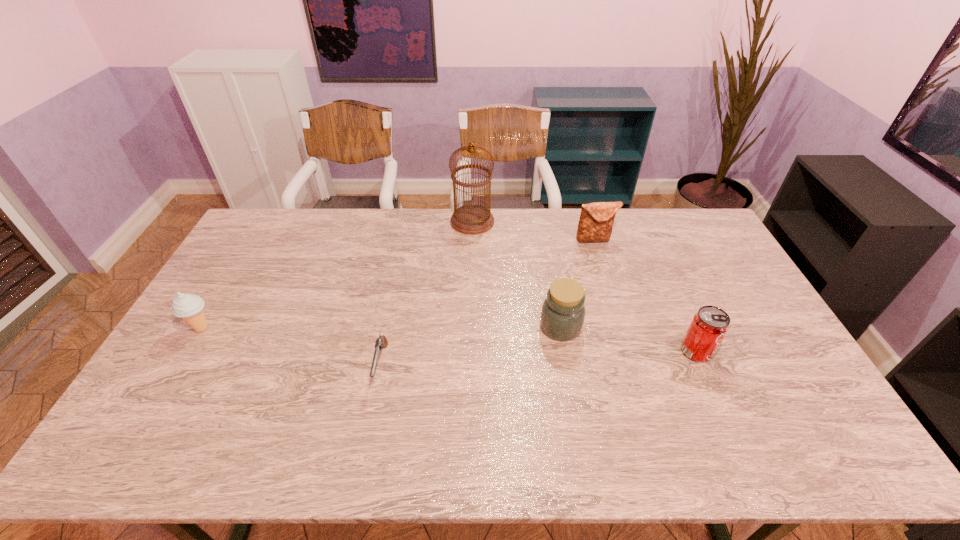
This screenshot has height=540, width=960. Identify the location of free spot located 0.320m on the front of the jar. (582, 450).

Identify the location of free space located on the right of the pop soda. (732, 351).

Find the location of a particular element. vacant area situated on the back of the leftmost object is located at coordinates (219, 299).

At what (x,y) coordinates should I click in order to perform the action: click on free space located aiming along the barrel of the second object from left to right. Please return your answer as a coordinate pair (x, y). Looking at the image, I should click on (366, 441).

Identify the location of birdcage at the far edge. This screenshot has width=960, height=540. (472, 219).

The height and width of the screenshot is (540, 960). I want to click on clutch bag at the far edge, so click(596, 220).

At what (x,y) coordinates should I click in order to perform the action: click on object that is positioned at the left edge. Please return your answer as a coordinate pair (x, y). Image resolution: width=960 pixels, height=540 pixels. Looking at the image, I should click on (189, 307).

Where is `free space at the far edge of the desktop`? The height and width of the screenshot is (540, 960). free space at the far edge of the desktop is located at coordinates (571, 215).

In the image, there is a desktop. Identify the location of vacant space at the near edge. (691, 436).

In the image, there is a desktop. At what (x,y) coordinates should I click in order to perform the action: click on free space at the right edge. Please return your answer as a coordinate pair (x, y). Image resolution: width=960 pixels, height=540 pixels. Looking at the image, I should click on (747, 387).